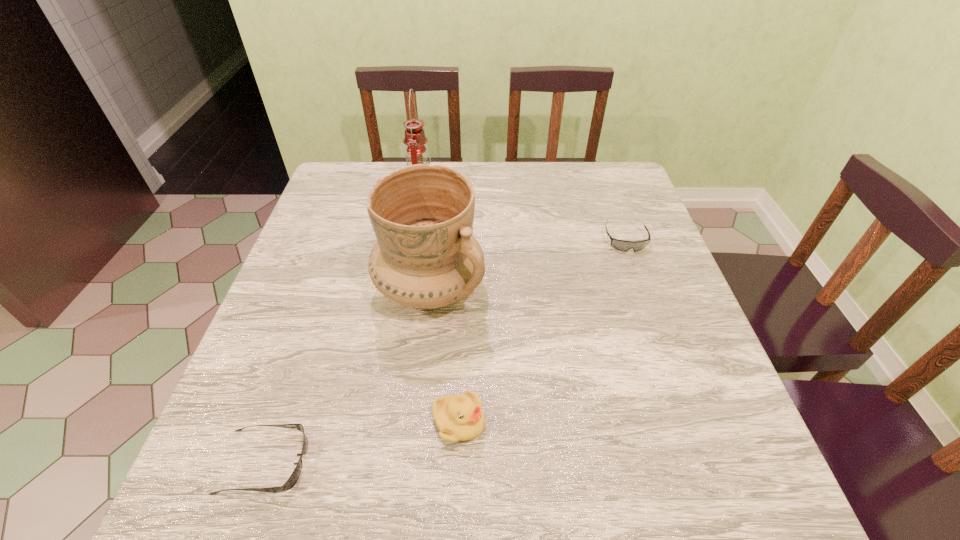
The width and height of the screenshot is (960, 540). Identify the location of free space between the goggles and the pottery. (527, 264).

Image resolution: width=960 pixels, height=540 pixels. Identify the location of free space between the rightmost object and the leftmost object. (444, 350).

I want to click on object that can be found as the closest to the rightmost object, so click(x=425, y=257).

Select which object is the closest to the shortest object. Please provide its 2D coordinates. Your answer should be formatted as a tuple, i.e. [(x, y)], where the tuple contains the x and y coordinates of a point satisfying the conditions above.

[(460, 417)]

Locate an element on the screen. The image size is (960, 540). vacant position in the image that satisfies the following two spatial constraints: 1. on the lenses of the rightmost object; 2. on the front-facing side of the shortest object is located at coordinates (706, 462).

Image resolution: width=960 pixels, height=540 pixels. Identify the location of vacant position in the image that satisfies the following two spatial constraints: 1. on the front side of the pottery; 2. on the left side of the farthest object. (404, 288).